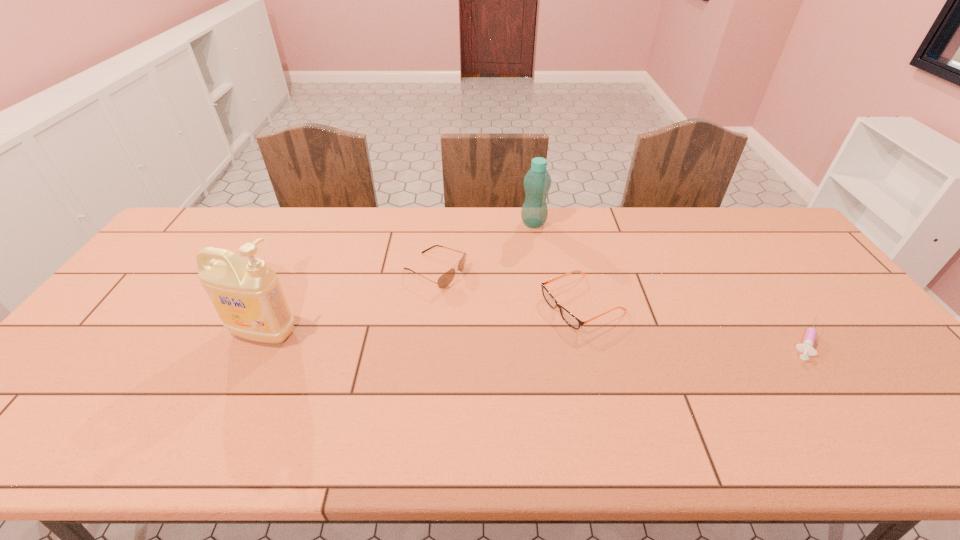
At what (x,y) coordinates should I click in order to perform the action: click on free region located on the back of the syringe. Please return your answer as a coordinate pair (x, y). Looking at the image, I should click on (x=731, y=233).

Identify the location of vacant space situated on the front-facing side of the third shortest object. The image size is (960, 540). (570, 329).

At what (x,y) coordinates should I click in order to perform the action: click on vacant area situated 0.100m on the front-facing side of the third shortest object. Please return your answer as a coordinate pair (x, y). The image size is (960, 540). Looking at the image, I should click on (490, 295).

The width and height of the screenshot is (960, 540). Identify the location of vacant position located 0.330m on the front-facing side of the third shortest object. (564, 326).

What are the coordinates of `vacant area located at the front cap of the second tallest object` in the screenshot? It's located at (570, 292).

Identify the location of free space located 0.300m at the front cap of the second tallest object. The width and height of the screenshot is (960, 540). (569, 289).

Where is `vacant space located 0.080m at the front cap of the second tallest object`? This screenshot has width=960, height=540. vacant space located 0.080m at the front cap of the second tallest object is located at coordinates (545, 245).

At what (x,y) coordinates should I click in order to perform the action: click on free spot located on the front-facing side of the second shortest object. Please return your answer as a coordinate pair (x, y). The width and height of the screenshot is (960, 540). Looking at the image, I should click on (510, 338).

You are a GUI agent. You are given a task and a screenshot of the screen. Output one action in this format:
    pyautogui.click(x=<x>, y=<y>)
    Task: Click on the vacant space located on the front-facing side of the second shortest object
    The height and width of the screenshot is (540, 960).
    Given the screenshot: What is the action you would take?
    pyautogui.click(x=449, y=366)

Identify the location of vacant area located on the front-facing side of the second shortest object. (456, 362).